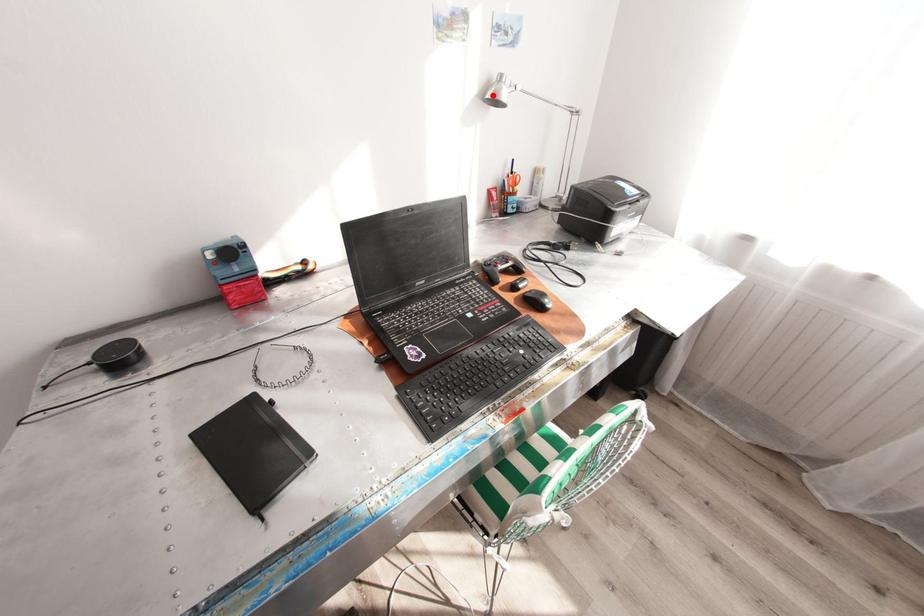
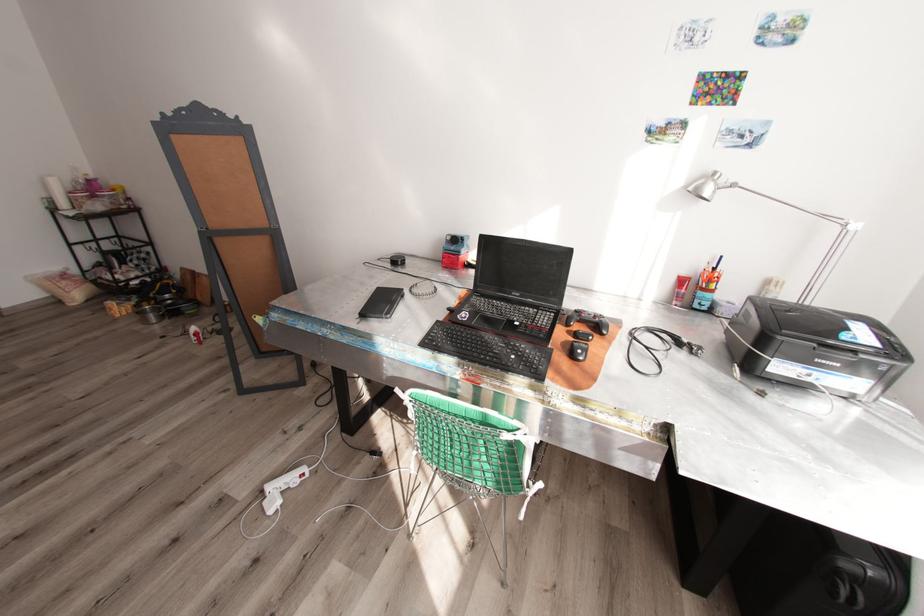
In the second image, find the point that corresponds to the highlighted location in the first image.

(695, 188)